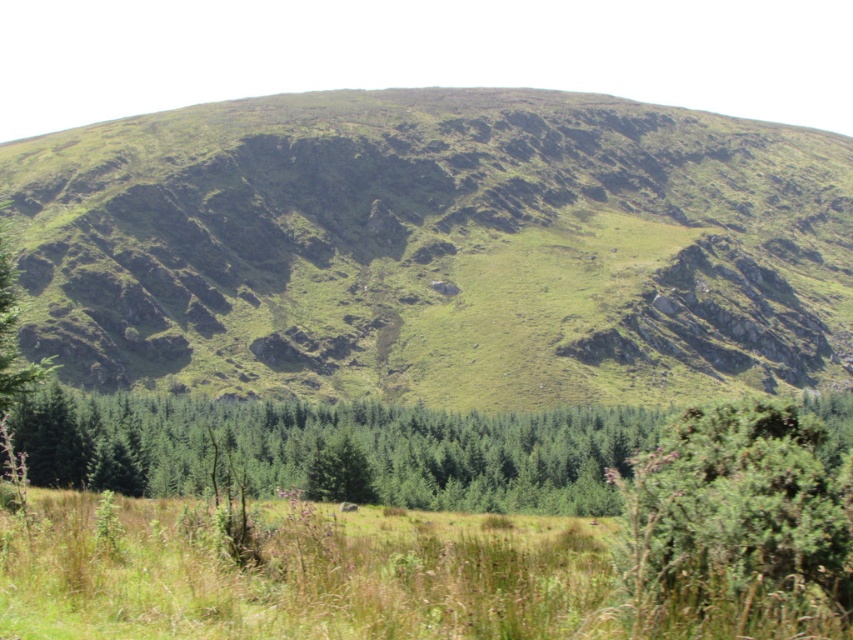
You are a hiker standing at the base of the green grassy hill at center and the green grassy field at lower center. Which terrain feature is higher in elevation?

The green grassy hill at center is higher in elevation than the green grassy field at lower center because it is positioned above it in the image.

You are standing at the base of the green grassy hill at center and want to walk to the green grassy field at lower center. Which direction should you go to reach the field without climbing the hill?

The green grassy field at lower center is behind the green grassy hill at center, so you should walk away from the hill in the direction opposite to its slope to reach the field without climbing.

You are standing at the point with coordinates [329,576] in the image. What do you see directly below you?

You are standing at point [329,576], which is located on the green grassy field at lower center.